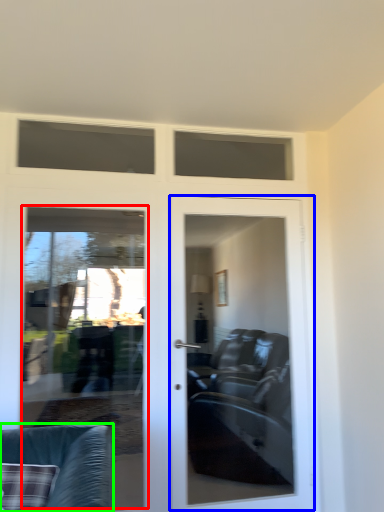
Question: Which object is positioned closest to screen door (highlighted by a red box)? Select from door (highlighted by a blue box) and chair (highlighted by a green box).

Choices:
 (A) door
 (B) chair

Answer: (A)